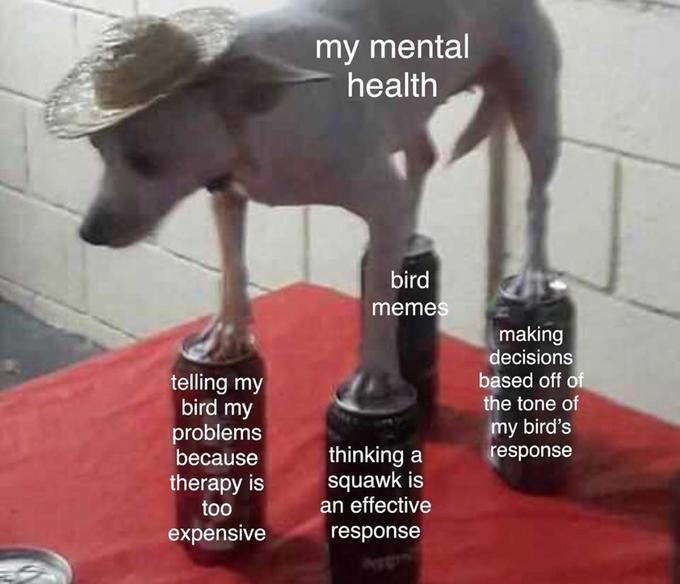
Find the location of `red tablecloth`. red tablecloth is located at coordinates click(x=33, y=449).